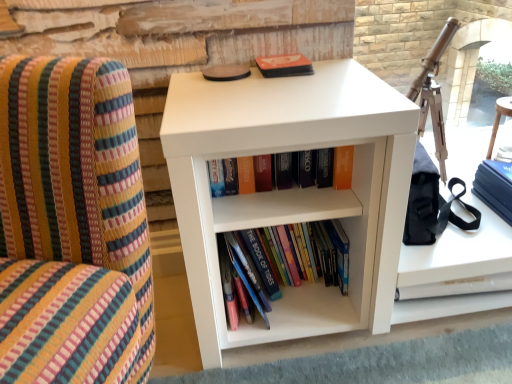
Question: Which is correct: hardcover books at center, arranged as the 1th book when ordered from the bottom, is inside matte orange book at center, positioned as the second book in bottom-to-top order, or outside of it?

Choices:
 (A) outside
 (B) inside

Answer: (A)

Question: From the image's perspective, is hardcover books at center, positioned as the second book in top-to-bottom order, above or below matte orange book at center, which ranks as the 1th book in top-to-bottom order?

Choices:
 (A) below
 (B) above

Answer: (A)

Question: Which object is the closest to the blue matte paperback book at right, which is the first paperback book from bottom to top?

Choices:
 (A) white matte bookshelf at center
 (B) matte orange book at center, positioned as the second book in bottom-to-top order
 (C) matte orange paperback book at upper center, marked as the first paperback book in a left-to-right arrangement
 (D) white matte cabinet at lower right
 (E) hardcover books at center, arranged as the 1th book when ordered from the bottom

Answer: (D)

Question: Estimate the real-world distances between objects in this image. Which object is closer to the white matte cabinet at lower right?

Choices:
 (A) matte orange paperback book at upper center, the 2th paperback book in the bottom-to-top sequence
 (B) blue matte paperback book at right, which is counted as the second paperback book, starting from the top
 (C) hardcover books at center, arranged as the 1th book when ordered from the bottom
 (D) matte orange book at center, positioned as the second book in bottom-to-top order
 (E) white matte bookshelf at center

Answer: (B)